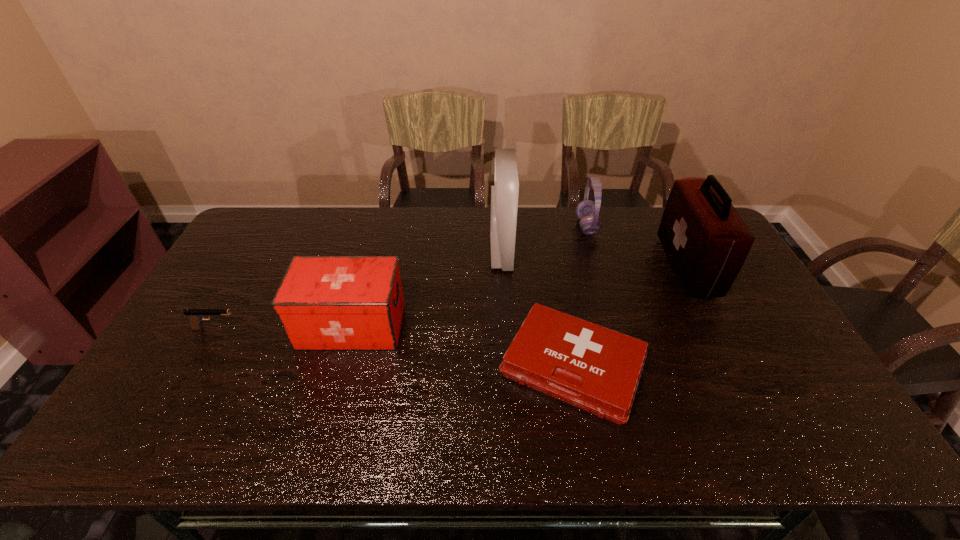
Identify the location of vacant area situated 0.240m on the headband and ear cups of the headset. Image resolution: width=960 pixels, height=540 pixels. (510, 226).

Locate an element on the screen. vacant space located 0.300m on the headband and ear cups of the headset is located at coordinates tap(493, 226).

Find the location of a particular element. The width and height of the screenshot is (960, 540). free space located 0.350m on the headband and ear cups of the headset is located at coordinates (480, 226).

Where is `blank space located on the handle side of the leftmost first-aid kit`? The width and height of the screenshot is (960, 540). blank space located on the handle side of the leftmost first-aid kit is located at coordinates (468, 326).

Where is `free space located at the muzzle of the pistol`? The width and height of the screenshot is (960, 540). free space located at the muzzle of the pistol is located at coordinates (295, 328).

At what (x,y) coordinates should I click in order to perform the action: click on vacant space situated on the back of the shortest object. Please return your answer as a coordinate pair (x, y). The height and width of the screenshot is (540, 960). Looking at the image, I should click on (555, 270).

Locate an element on the screen. headset present at the far edge is located at coordinates (587, 211).

At what (x,y) coordinates should I click in order to perform the action: click on object that is at the near edge. Please return your answer as a coordinate pair (x, y). The width and height of the screenshot is (960, 540). Looking at the image, I should click on (597, 369).

Where is `object that is at the left edge`? The image size is (960, 540). object that is at the left edge is located at coordinates (195, 316).

In order to click on object that is at the right edge in this screenshot , I will do `click(706, 241)`.